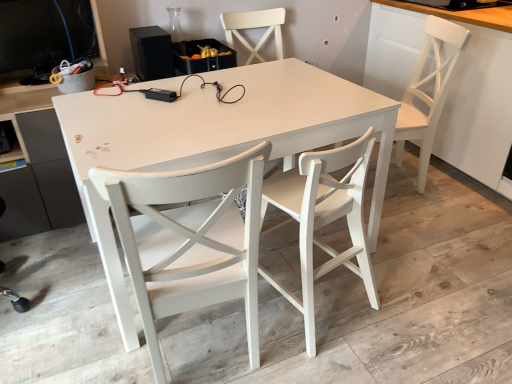
Identify the location of vacant area that lies in front of white wood chair at right, positioned as the third chair in left-to-right order. (429, 223).